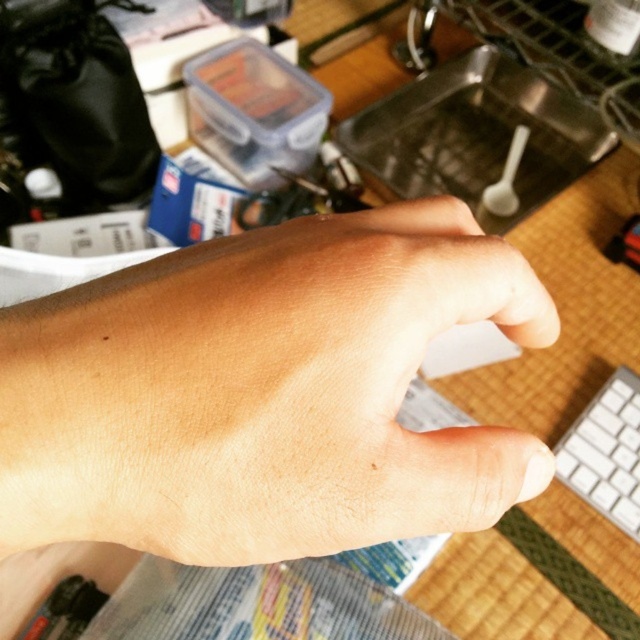
Is skinsmoothhand at center smaller than white plastic keyboard at lower right?

No, skinsmoothhand at center is not smaller than white plastic keyboard at lower right.

Does skinsmoothhand at center appear on the right side of white plastic keyboard at lower right?

In fact, skinsmoothhand at center is to the left of white plastic keyboard at lower right.

This screenshot has height=640, width=640. Describe the element at coordinates (262, 392) in the screenshot. I see `skinsmoothhand at center` at that location.

At what (x,y) coordinates should I click in order to perform the action: click on skinsmoothhand at center. Please return your answer as a coordinate pair (x, y). Looking at the image, I should click on (262, 392).